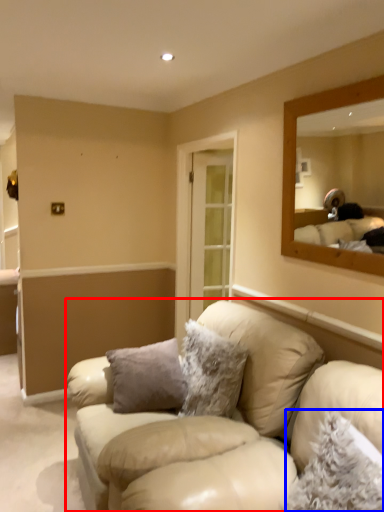
Question: Which of the following is the closest to the observer, studio couch (highlighted by a red box) or pillow (highlighted by a blue box)?

Choices:
 (A) studio couch
 (B) pillow

Answer: (B)